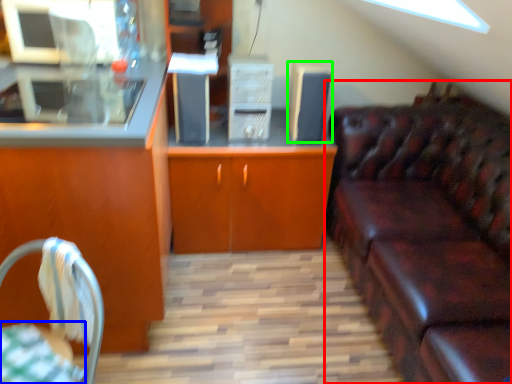
Question: Estimate the real-world distances between objects in this image. Which object is closer to studio couch (highlighted by a red box), tablecloth (highlighted by a blue box) or appliance (highlighted by a green box)?

Choices:
 (A) tablecloth
 (B) appliance

Answer: (B)